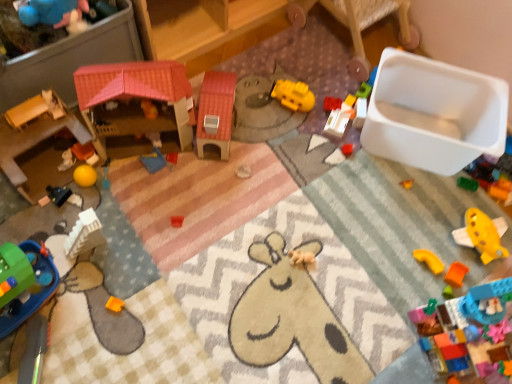
Where is `free space between white plastic container at center, acting as the 10th toy starting from the left, and translucent blue plastic blocks at lower right, the thirteenth toy viewed from the left`? free space between white plastic container at center, acting as the 10th toy starting from the left, and translucent blue plastic blocks at lower right, the thirteenth toy viewed from the left is located at coordinates point(392,233).